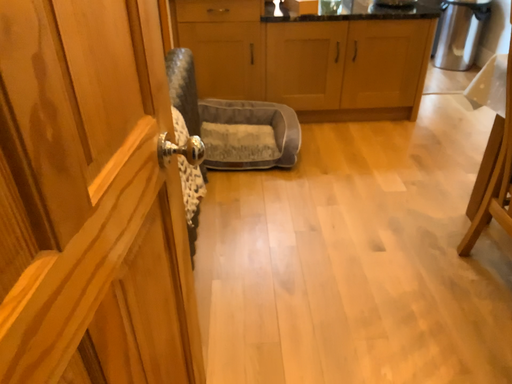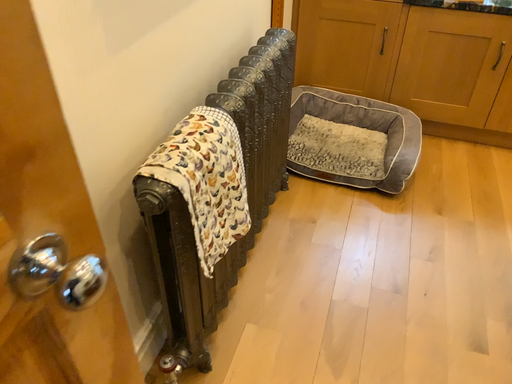
Question: Which way did the camera rotate in the video?

Choices:
 (A) rotated right
 (B) rotated left

Answer: (B)